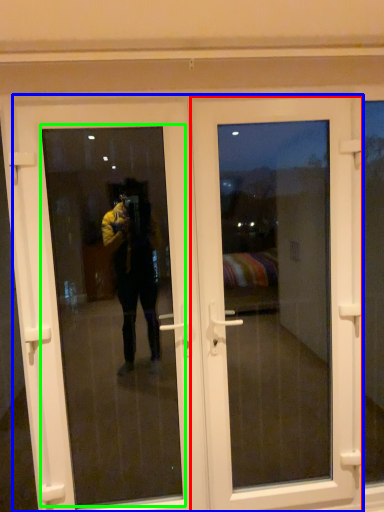
Question: Which object is positioned closest to door (highlighted by a red box)? Select from door (highlighted by a blue box) and window screen (highlighted by a green box).

Choices:
 (A) door
 (B) window screen

Answer: (A)